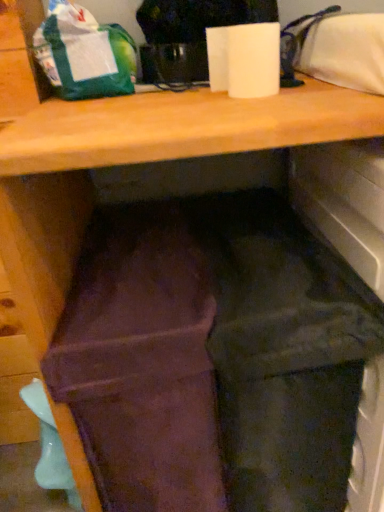
Question: From the image's perspective, is brown suede wallet at center positioned above or below green matte bag at upper left?

Choices:
 (A) below
 (B) above

Answer: (A)

Question: Is brown suede wallet at center to the left or to the right of green matte bag at upper left in the image?

Choices:
 (A) left
 (B) right

Answer: (B)

Question: Which is farther from the white matte paper towel at upper center?

Choices:
 (A) green matte bag at upper left
 (B) brown suede wallet at center
 (C) matte teal plastic spoon at lower left

Answer: (C)

Question: Which is nearer to the brown suede wallet at center?

Choices:
 (A) white matte paper towel at upper center
 (B) matte teal plastic spoon at lower left
 (C) green matte bag at upper left

Answer: (B)